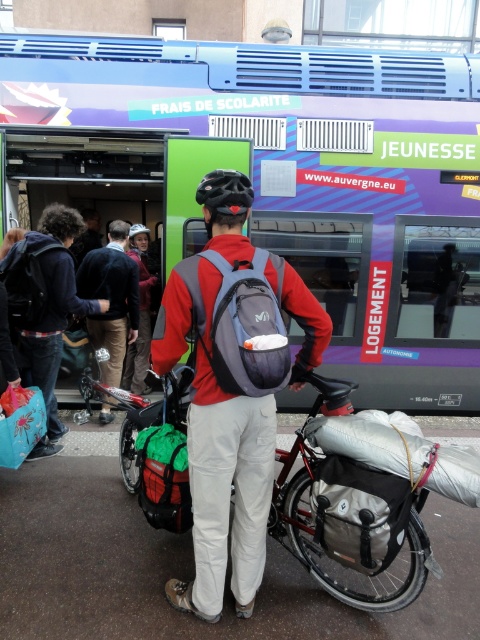
You are packing for a trip and have a matte gray backpack at center and a brushed metal helmet at upper center. Which item can hold more items based on their size?

The matte gray backpack at center is bigger than the brushed metal helmet at upper center, so it can hold more items.

You are a delivery person who needs to move a package from the gray fabric bag at center to the matte blue fabric bag at lower left. The package is 2 feet long. Can you slide it directly between them without rotating?

The distance between the gray fabric bag at center and the matte blue fabric bag at lower left is 6.67 feet, which is greater than the package length of 2 feet. Yes, you can slide it directly between them without rotating.

You are a traveler who needs to locate your two bags. You see a gray fabric bag at center and a matte blue fabric bag at lower left. Which one is positioned to the right of the other?

The gray fabric bag at center is to the right of the matte blue fabric bag at lower left.